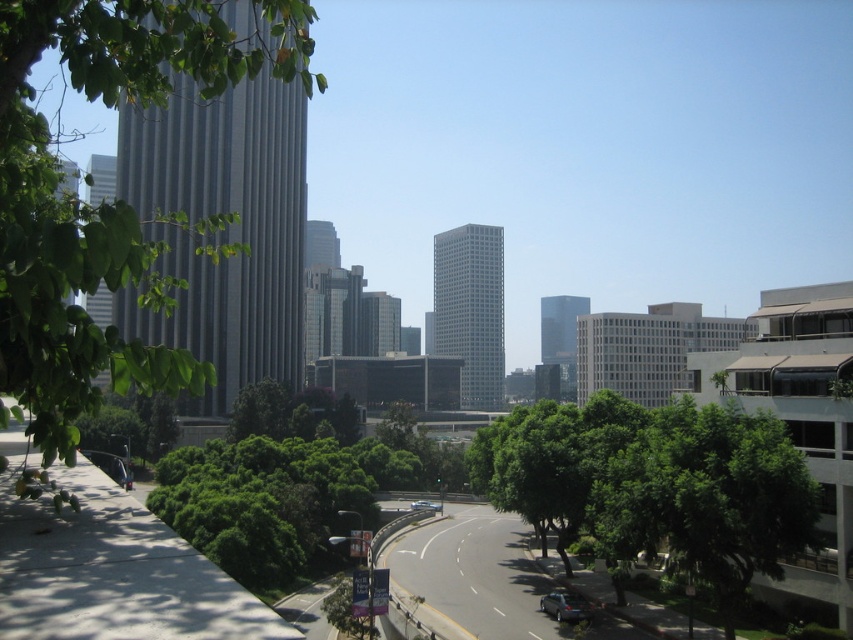
The height and width of the screenshot is (640, 853). Find the location of `green leafy tree at center`. green leafy tree at center is located at coordinates (654, 484).

Does green leafy tree at center appear under shiny silver sedan at lower center?

Incorrect, green leafy tree at center is not positioned below shiny silver sedan at lower center.

At what (x,y) coordinates should I click in order to perform the action: click on green leafy tree at center. Please return your answer as a coordinate pair (x, y). The image size is (853, 640). Looking at the image, I should click on (654, 484).

This screenshot has width=853, height=640. I want to click on green leafy tree at center, so click(654, 484).

Can you confirm if green leafy tree at left is positioned above green leafy tree at center?

Indeed, green leafy tree at left is positioned over green leafy tree at center.

Is green leafy tree at left to the right of green leafy tree at center from the viewer's perspective?

No, green leafy tree at left is not to the right of green leafy tree at center.

Find the location of a particular element. green leafy tree at left is located at coordinates (113, 200).

Is shiny silver sedan at lower center below blue metallic car at center?

Incorrect, shiny silver sedan at lower center is not positioned below blue metallic car at center.

Does point (567, 595) come closer to viewer compared to point (434, 508)?

Yes, it is.

This screenshot has height=640, width=853. What are the coordinates of `shiny silver sedan at lower center` in the screenshot? It's located at (566, 605).